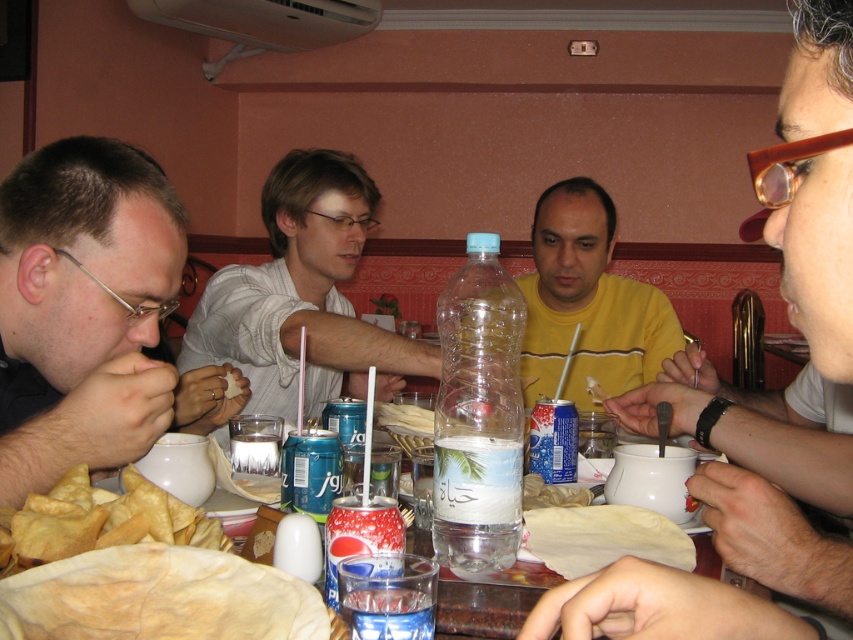
You are a GUI agent. You are given a task and a screenshot of the screen. Output one action in this format:
    pyautogui.click(x=<x>, y=<y>)
    Task: Click on the white matte shirt at center
    The width and height of the screenshot is (853, 640).
    Given the screenshot: What is the action you would take?
    point(302,296)

How much distance is there between white matte shirt at center and clear plastic cup at center?

white matte shirt at center is 22.60 inches away from clear plastic cup at center.

Is point (427, 344) positioned before point (230, 460)?

No.

I want to click on white matte shirt at center, so click(x=302, y=296).

Does point (567, 620) come closer to viewer compared to point (520, 323)?

Yes, it is.

Describe the element at coordinates (814, 182) in the screenshot. The height and width of the screenshot is (640, 853). I see `yellow matte shirt at center` at that location.

Who is more forward, [815,205] or [474,284]?

Point [815,205]

Identify the location of yellow matte shirt at center. This screenshot has height=640, width=853. (814, 182).

At what (x,y) coordinates should I click in order to perform the action: click on yellow matte shirt at center. Please return your answer as a coordinate pair (x, y). Looking at the image, I should click on pos(814,182).

Is point (782, 124) behind point (409, 602)?

No, it is not.

This screenshot has width=853, height=640. Describe the element at coordinates (814, 182) in the screenshot. I see `yellow matte shirt at center` at that location.

Where is `yellow matte shirt at center`? This screenshot has width=853, height=640. yellow matte shirt at center is located at coordinates (814, 182).